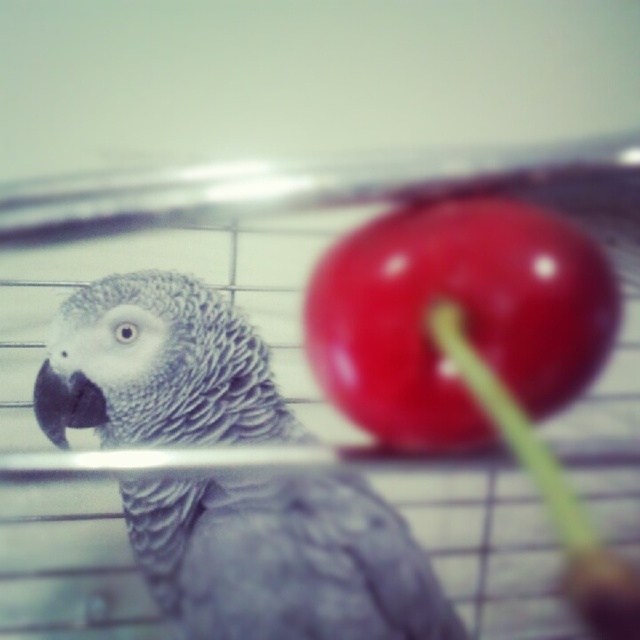
Question: Is gray matte parrot at center thinner than shiny red cherry at center?

Choices:
 (A) no
 (B) yes

Answer: (A)

Question: Does gray matte parrot at center have a greater width compared to shiny red cherry at center?

Choices:
 (A) no
 (B) yes

Answer: (B)

Question: Can you confirm if gray matte parrot at center is positioned to the right of shiny red cherry at center?

Choices:
 (A) yes
 (B) no

Answer: (B)

Question: Which point is closer to the camera?

Choices:
 (A) (588, 289)
 (B) (317, 605)

Answer: (B)

Question: Which of the following is the farthest from the observer?

Choices:
 (A) shiny red cherry at center
 (B) gray matte parrot at center

Answer: (A)